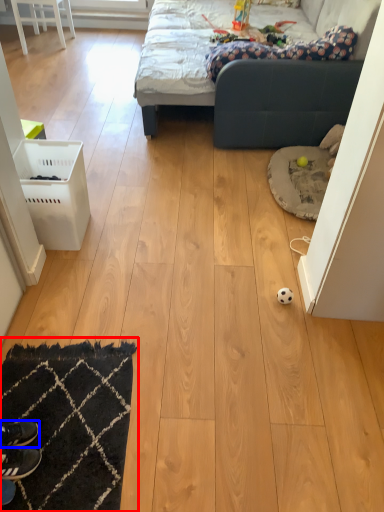
Question: Which object is further to the camera taking this photo, mat (highlighted by a red box) or footwear (highlighted by a blue box)?

Choices:
 (A) mat
 (B) footwear

Answer: (B)